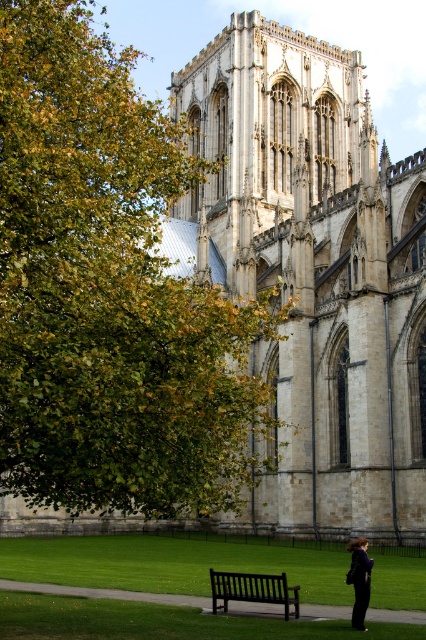
Does stone gothic cathedral at center have a greater height compared to dark blue fabric coat at lower right?

Yes.

Which is behind, point (348, 161) or point (354, 545)?

The point (348, 161) is more distant.

Where is `stone gothic cathedral at center`? Image resolution: width=426 pixels, height=640 pixels. stone gothic cathedral at center is located at coordinates (313, 269).

Is green leafy tree at left wider than black wooden bench at lower center?

Yes, green leafy tree at left is wider than black wooden bench at lower center.

Is green leafy tree at left smaller than black wooden bench at lower center?

Incorrect, green leafy tree at left is not smaller in size than black wooden bench at lower center.

Where is `green leafy tree at left`? The width and height of the screenshot is (426, 640). green leafy tree at left is located at coordinates (109, 291).

Looking at this image, is green leafy tree at left taller than stone gothic cathedral at center?

Indeed, green leafy tree at left has a greater height compared to stone gothic cathedral at center.

Can you confirm if green leafy tree at left is positioned above stone gothic cathedral at center?

Correct, green leafy tree at left is located above stone gothic cathedral at center.

I want to click on green leafy tree at left, so click(109, 291).

The width and height of the screenshot is (426, 640). In order to click on green leafy tree at left in this screenshot , I will do `click(109, 291)`.